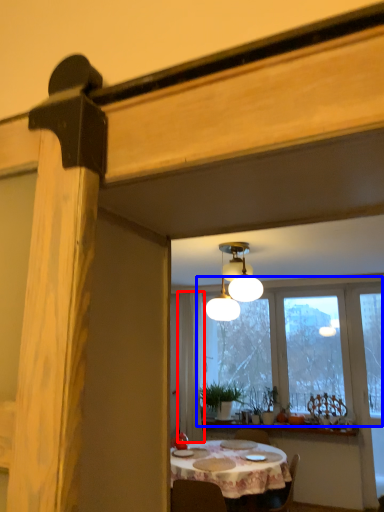
Question: Which point is closer to the camera, curtain (highlighted by a red box) or window (highlighted by a blue box)?

Choices:
 (A) curtain
 (B) window

Answer: (B)